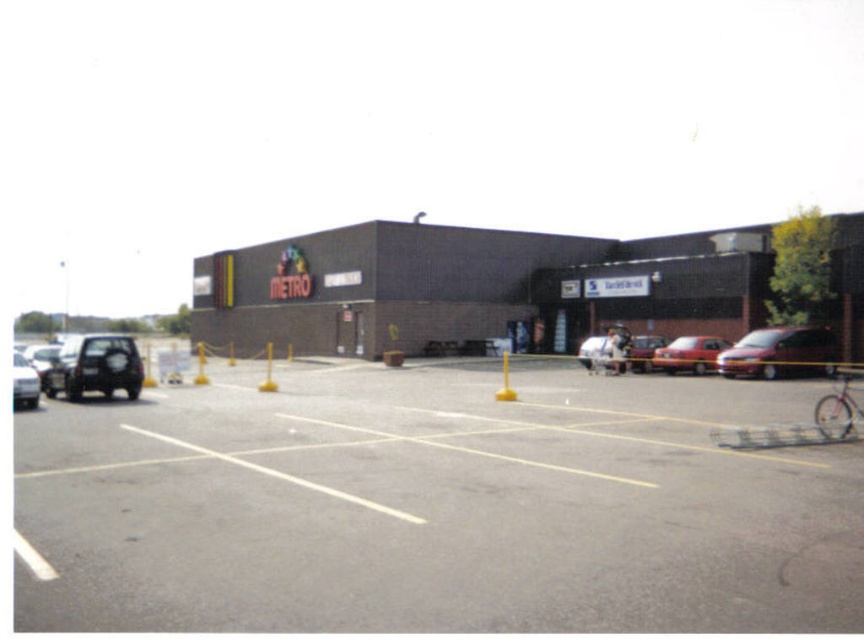
You are a delivery driver who needs to park your truck in the gray asphalt parking lot at center. Your truck is 12 feet wide. Can you fit your truck into the parking space if the matte red car at right is parked there?

The gray asphalt parking lot at center is larger in size than the matte red car at right, so the truck can fit into the parking space even if the matte red car at right is parked there.

You are standing in the commercial area in front of the METRO building. There are two points marked on the ground at coordinates point (x=583, y=381) and point (x=658, y=349). If you want to walk towards the METRO entrance, which point should you step on first?

You should step on point (x=583, y=381) first because it is closer to you than point (x=658, y=349), so you will reach it sooner while moving toward the METRO entrance.

You are a delivery driver who needs to park your vehicle in the parking lot. You see a metallic maroon van at right and a matte red car at right. Which vehicle should you move to access the parking spot behind them?

You should move the metallic maroon van at right first because it is in front of the matte red car at right, so accessing the spot behind requires moving the van first.